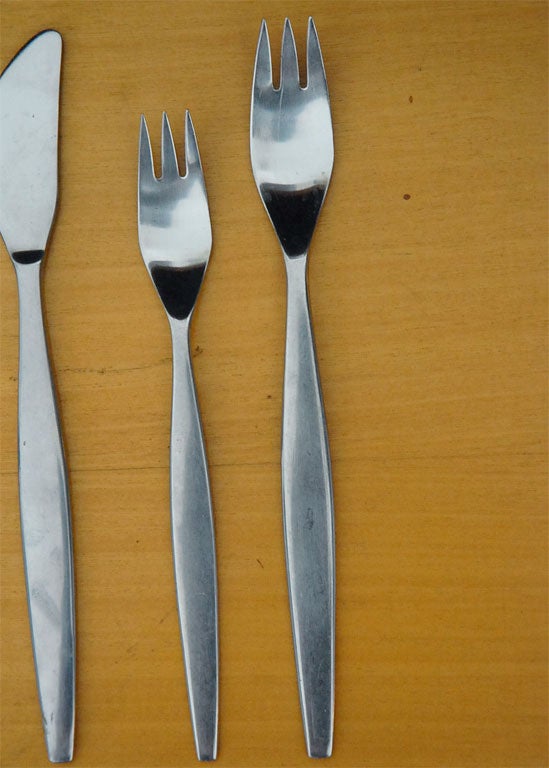
Where is `dining utensils`? The height and width of the screenshot is (768, 549). dining utensils is located at coordinates (289, 214), (184, 240), (36, 210).